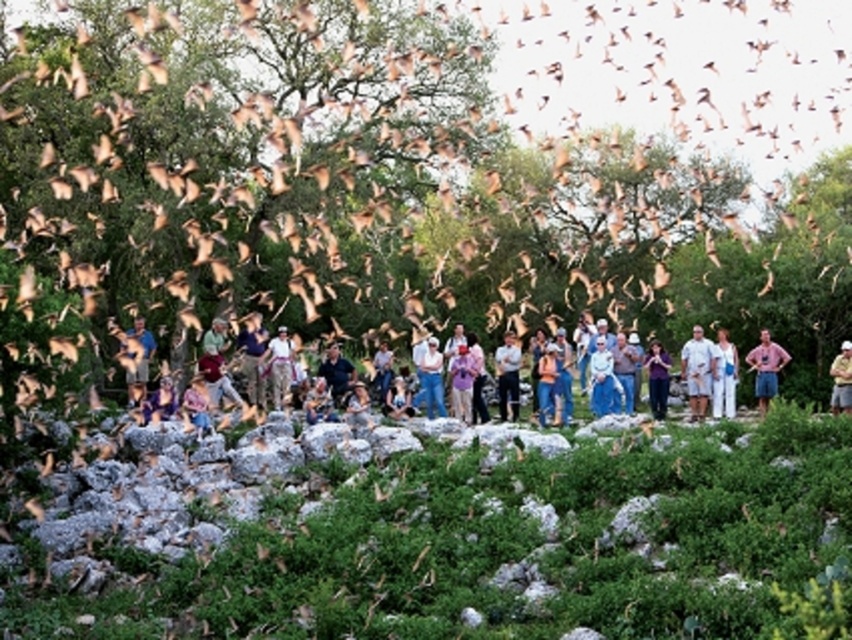
This screenshot has width=852, height=640. Describe the element at coordinates (378, 180) in the screenshot. I see `green leafy tree at center` at that location.

Where is `green leafy tree at center`? The height and width of the screenshot is (640, 852). green leafy tree at center is located at coordinates (378, 180).

Does pink cotton shirt at right appear over khaki cotton shirt at center?

Actually, pink cotton shirt at right is below khaki cotton shirt at center.

This screenshot has height=640, width=852. I want to click on pink cotton shirt at right, so click(766, 368).

Who is higher up, green leafy tree at center or white cotton shirt at center?

green leafy tree at center is higher up.

Does point (314, 157) lie behind point (727, 342)?

That is True.

Is point (585, 148) farther from viewer compared to point (729, 358)?

Yes, it is.

Where is `green leafy tree at center`? The width and height of the screenshot is (852, 640). green leafy tree at center is located at coordinates (378, 180).